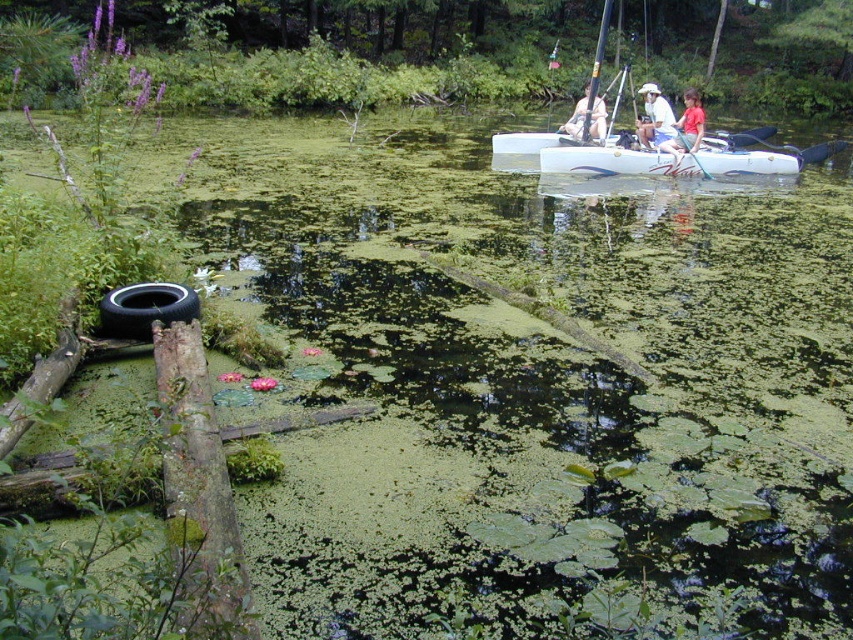
You are standing on the dock near the pond and want to reach the red cotton shirt at upper right and the matte white kayak at upper center. The distance between them is 2.15 meters. If you can only carry one item at a time and need to return to the dock after each trip, how many trips will it take to move both items to the dock?

To move both the red cotton shirt at upper right and the matte white kayak at upper center to the dock, you would need two trips. First, take one item to the dock, return to the starting point, then take the second item to the dock.

You are a photographer trying to capture the white fabric hat at upper center and the matte white kayak at upper center in the same frame. Since both are at the same height, which object would you need to position your camera closer to in order to ensure the hat is fully visible without cropping?

The white fabric hat at upper center is thinner than the matte white kayak at upper center. To ensure the hat is fully visible without cropping, you should position your camera closer to the white fabric hat at upper center because its narrower width requires a closer focus to capture its full form within the frame.